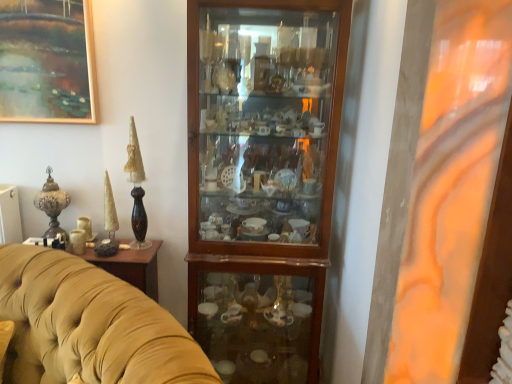
Question: Considering the relative sizes of velvet yellow couch at center and polished bronze vase at left in the image provided, is velvet yellow couch at center taller than polished bronze vase at left?

Choices:
 (A) no
 (B) yes

Answer: (B)

Question: Can you confirm if velvet yellow couch at center is positioned to the right of polished bronze vase at left?

Choices:
 (A) no
 (B) yes

Answer: (B)

Question: Is velvet yellow couch at center next to polished bronze vase at left and touching it?

Choices:
 (A) yes
 (B) no

Answer: (B)

Question: Is velvet yellow couch at center bigger than polished bronze vase at left?

Choices:
 (A) no
 (B) yes

Answer: (B)

Question: Is velvet yellow couch at center oriented towards polished bronze vase at left?

Choices:
 (A) no
 (B) yes

Answer: (A)

Question: Considering the positions of wooden cabinet at center and velvet yellow couch at center in the image, is wooden cabinet at center bigger or smaller than velvet yellow couch at center?

Choices:
 (A) big
 (B) small

Answer: (B)

Question: Is point (316, 339) positioned closer to the camera than point (73, 319)?

Choices:
 (A) farther
 (B) closer

Answer: (A)

Question: Considering the positions of wooden cabinet at center and velvet yellow couch at center in the image, is wooden cabinet at center taller or shorter than velvet yellow couch at center?

Choices:
 (A) tall
 (B) short

Answer: (A)

Question: Is wooden cabinet at center in front of or behind velvet yellow couch at center in the image?

Choices:
 (A) front
 (B) behind

Answer: (B)

Question: Looking at the image, does wooden cabinet at center seem bigger or smaller compared to polished bronze vase at left?

Choices:
 (A) big
 (B) small

Answer: (A)

Question: Considering the positions of wooden cabinet at center and polished bronze vase at left in the image, is wooden cabinet at center wider or thinner than polished bronze vase at left?

Choices:
 (A) wide
 (B) thin

Answer: (A)

Question: In the image, is wooden cabinet at center positioned in front of or behind polished bronze vase at left?

Choices:
 (A) behind
 (B) front

Answer: (B)

Question: Is wooden cabinet at center taller or shorter than polished bronze vase at left?

Choices:
 (A) tall
 (B) short

Answer: (A)

Question: Is point (145, 360) closer or farther from the camera than point (55, 190)?

Choices:
 (A) closer
 (B) farther

Answer: (A)

Question: From their relative heights in the image, would you say velvet yellow couch at center is taller or shorter than polished bronze vase at left?

Choices:
 (A) short
 (B) tall

Answer: (B)